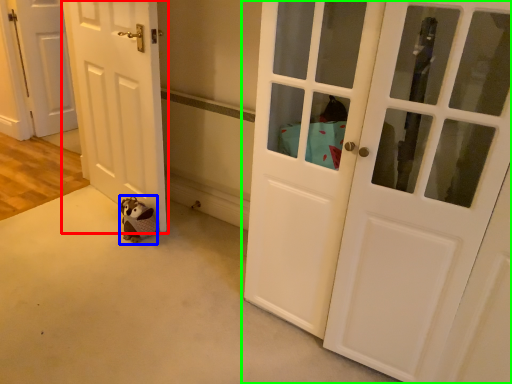
Question: Estimate the real-world distances between objects in this image. Which object is farther from door (highlighted by a red box), animal (highlighted by a blue box) or door (highlighted by a green box)?

Choices:
 (A) animal
 (B) door

Answer: (B)